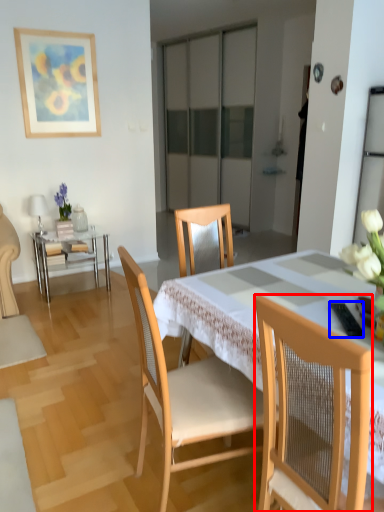
Question: Which point is further to the camera, chair (highlighted by a red box) or remote control (highlighted by a blue box)?

Choices:
 (A) chair
 (B) remote control

Answer: (B)